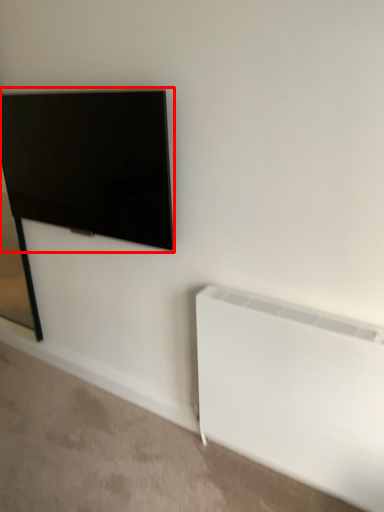
Question: From the image's perspective, where is television (annotated by the red box) located in relation to radiator in the image?

Choices:
 (A) above
 (B) below

Answer: (A)